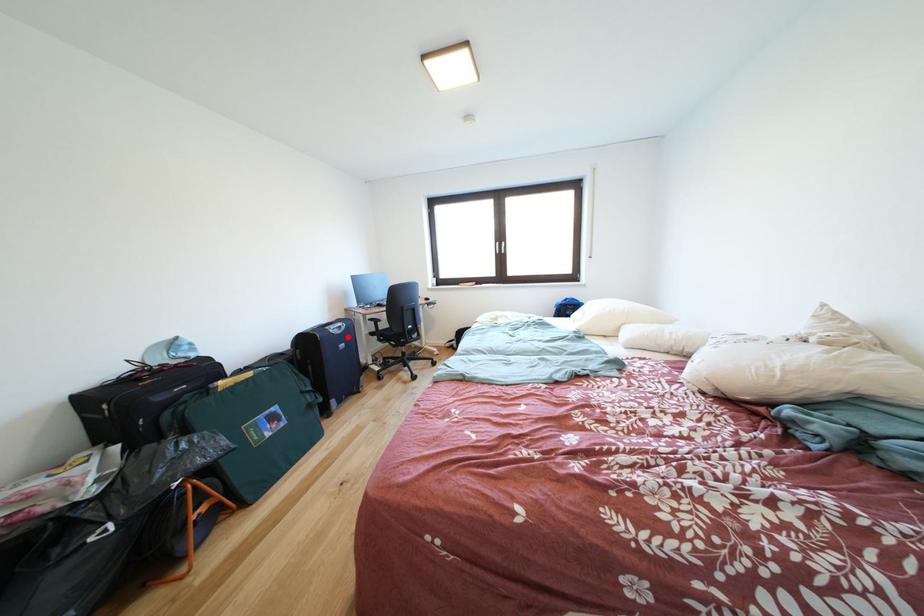
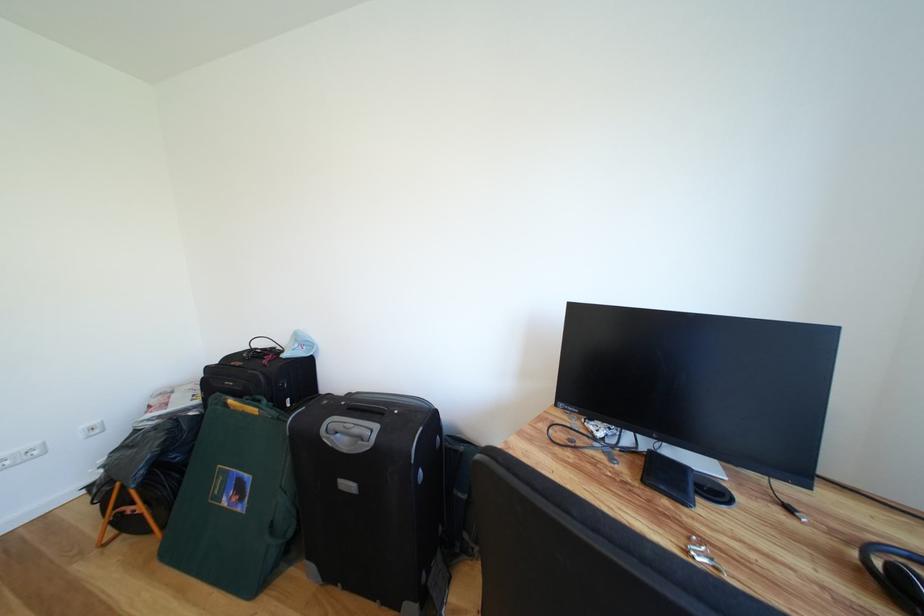
Question: A red point is marked in image1. In image2, is the corresponding 3D point closer to the camera or farther? Reply with the corresponding letter.

Choices:
 (A) The corresponding 3D point is closer.
 (B) The corresponding 3D point is farther.

Answer: (B)